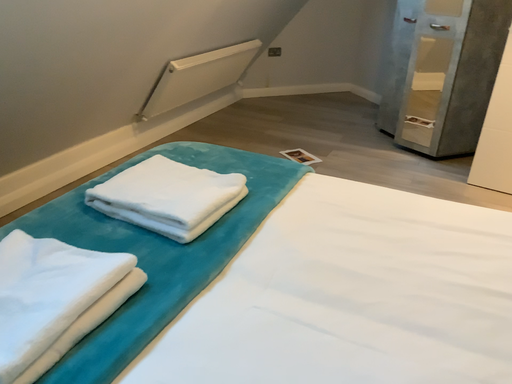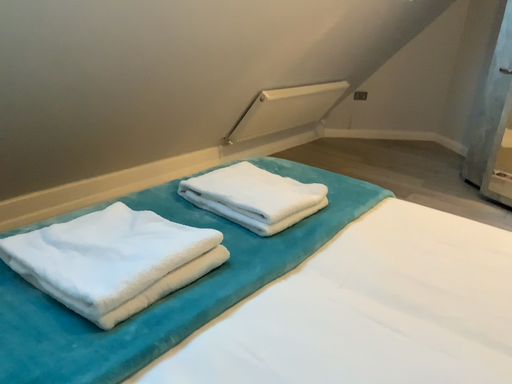
Question: Which way did the camera rotate in the video?

Choices:
 (A) rotated right
 (B) rotated left

Answer: (B)